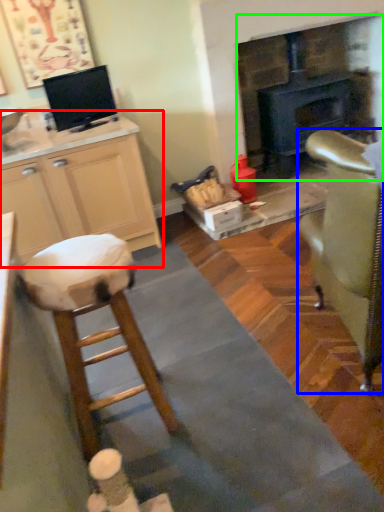
Question: Based on their relative distances, which object is nearer to cabinetry (highlighted by a red box)? Choose from chair (highlighted by a blue box) and fireplace (highlighted by a green box).

Choices:
 (A) chair
 (B) fireplace

Answer: (A)